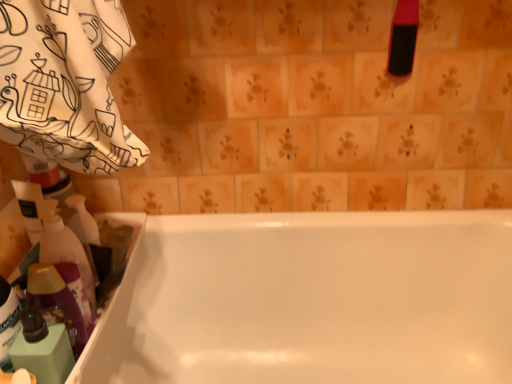
Question: Is the depth of pink rubber brush at upper right, which appears as the 1th cleaning product when viewed from the top, greater than that of white glossy bathtub at center?

Choices:
 (A) yes
 (B) no

Answer: (A)

Question: Is pink rubber brush at upper right, which appears as the 1th cleaning product when viewed from the top, not near white glossy bathtub at center?

Choices:
 (A) no
 (B) yes

Answer: (A)

Question: Considering the relative positions of pink rubber brush at upper right, which appears as the 1th cleaning product when viewed from the right, and white glossy bathtub at center in the image provided, is pink rubber brush at upper right, which appears as the 1th cleaning product when viewed from the right, to the left of white glossy bathtub at center from the viewer's perspective?

Choices:
 (A) no
 (B) yes

Answer: (A)

Question: From a real-world perspective, does pink rubber brush at upper right, which is the third cleaning product in left-to-right order, sit lower than white glossy bathtub at center?

Choices:
 (A) no
 (B) yes

Answer: (A)

Question: Does pink rubber brush at upper right, which appears as the 1th cleaning product when viewed from the right, contain white glossy bathtub at center?

Choices:
 (A) no
 (B) yes

Answer: (A)

Question: Visually, is translucent plastic bottle at left, the second cleaning product positioned from the top, positioned to the left or to the right of translucent plastic bottle at lower left, placed as the 3th cleaning product when sorted from right to left?

Choices:
 (A) right
 (B) left

Answer: (A)

Question: Considering the positions of translucent plastic bottle at left, which appears as the second cleaning product when ordered from the bottom, and translucent plastic bottle at lower left, placed as the 3th cleaning product when sorted from right to left, in the image, is translucent plastic bottle at left, which appears as the second cleaning product when ordered from the bottom, taller or shorter than translucent plastic bottle at lower left, placed as the 3th cleaning product when sorted from right to left,?

Choices:
 (A) tall
 (B) short

Answer: (A)

Question: Is translucent plastic bottle at left, the second cleaning product in the left-to-right sequence, wider or thinner than translucent plastic bottle at lower left, placed as the 3th cleaning product when sorted from right to left?

Choices:
 (A) wide
 (B) thin

Answer: (A)

Question: From a real-world perspective, relative to translucent plastic bottle at lower left, arranged as the first cleaning product when viewed from the left, is translucent plastic bottle at left, marked as the second cleaning product in a right-to-left arrangement, vertically above or below?

Choices:
 (A) above
 (B) below

Answer: (A)

Question: Is point (499, 334) positioned closer to the camera than point (14, 349)?

Choices:
 (A) farther
 (B) closer

Answer: (A)

Question: Looking at the image, does white glossy bathtub at center seem bigger or smaller compared to translucent plastic bottle at lower left, which is the 1th cleaning product in bottom-to-top order?

Choices:
 (A) small
 (B) big

Answer: (B)

Question: From a real-world perspective, is white glossy bathtub at center above or below translucent plastic bottle at lower left, arranged as the first cleaning product when viewed from the left?

Choices:
 (A) below
 (B) above

Answer: (A)

Question: Is white glossy bathtub at center in front of or behind translucent plastic bottle at lower left, arranged as the first cleaning product when viewed from the left, in the image?

Choices:
 (A) behind
 (B) front

Answer: (A)

Question: In the image, is pink rubber brush at upper right, acting as the 3th cleaning product starting from the bottom, positioned in front of or behind white glossy bathtub at center?

Choices:
 (A) front
 (B) behind

Answer: (B)

Question: From a real-world perspective, relative to white glossy bathtub at center, is pink rubber brush at upper right, which is the third cleaning product in left-to-right order, vertically above or below?

Choices:
 (A) above
 (B) below

Answer: (A)